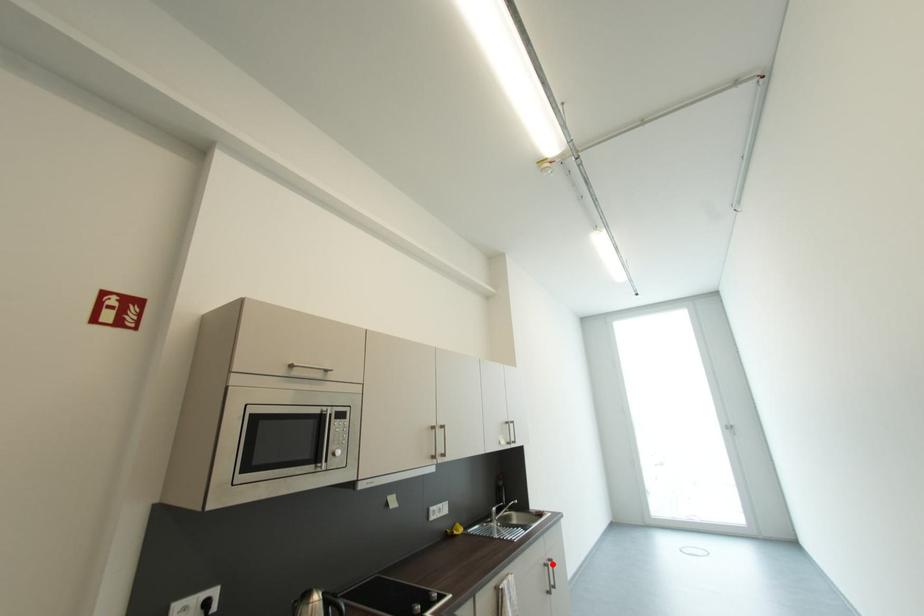
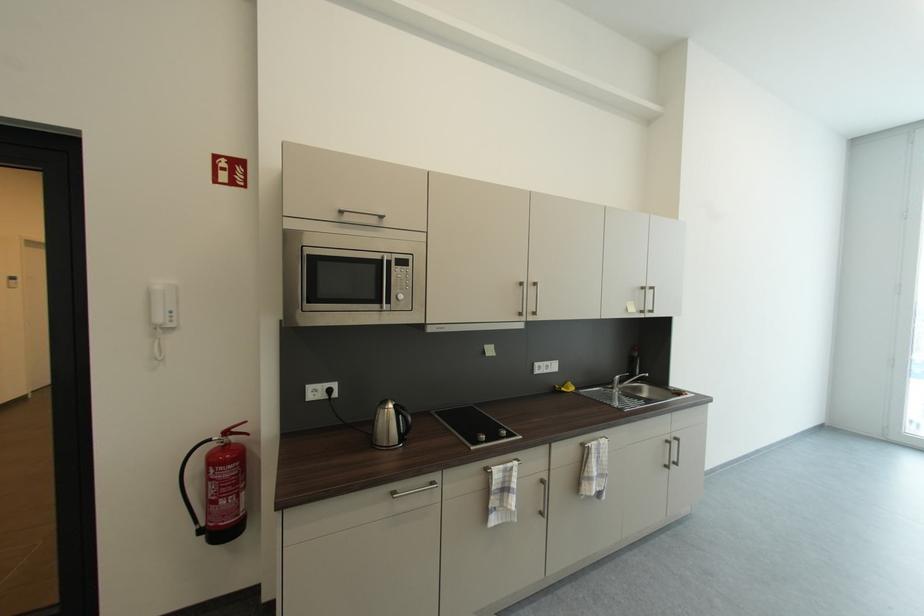
The point at the highlighted location is marked in the first image. Where is the corresponding point in the second image?

(675, 440)